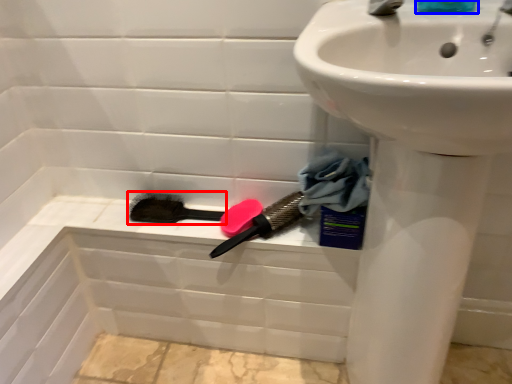
Question: Which object appears closest to the camera in this image, brush (highlighted by a red box) or liquid (highlighted by a blue box)?

Choices:
 (A) brush
 (B) liquid

Answer: (B)